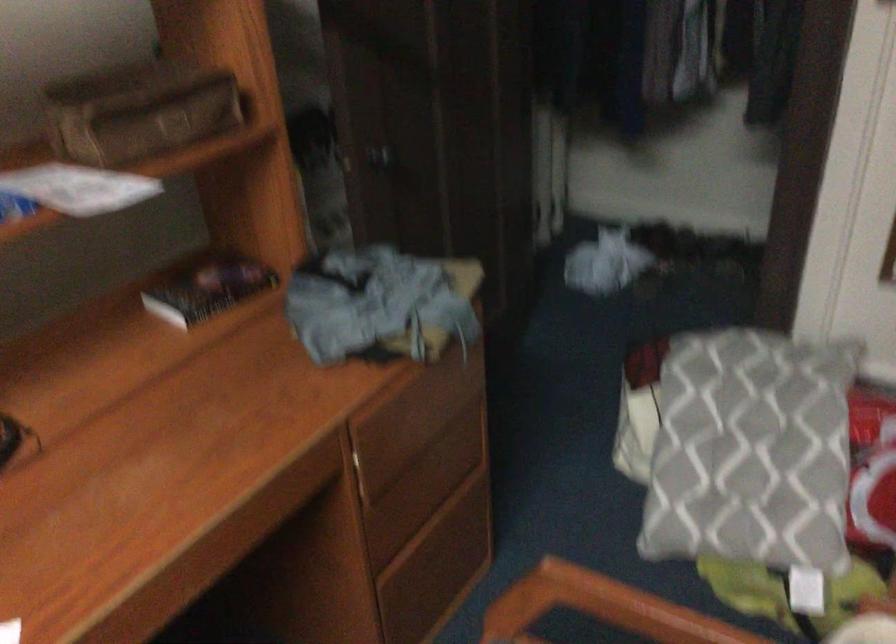
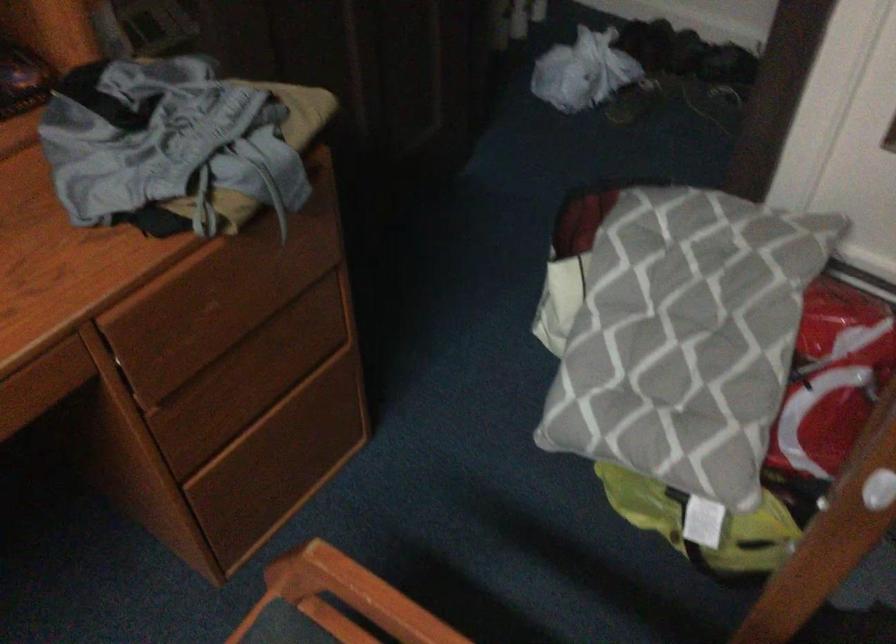
In the second image, find the point that corresponds to pixel 423 495 in the first image.

(254, 377)